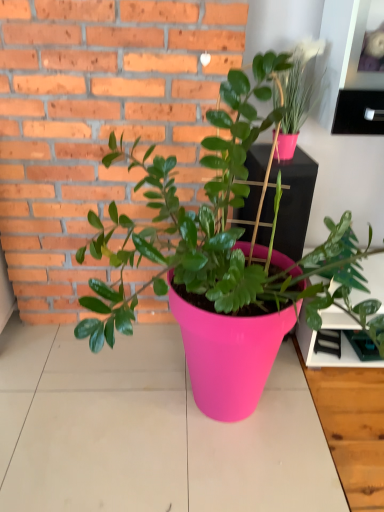
This screenshot has height=512, width=384. What do you see at coordinates (224, 260) in the screenshot? I see `pink plastic pot at center, the 1th houseplant viewed from the left` at bounding box center [224, 260].

Find the location of `pink plastic table top at center`. pink plastic table top at center is located at coordinates (149, 431).

What do you see at coordinates (294, 96) in the screenshot?
I see `matte pink pot at upper right, which is counted as the first houseplant, starting from the right` at bounding box center [294, 96].

You are a GUI agent. You are given a task and a screenshot of the screen. Output one action in this format:
    pyautogui.click(x=<x>, y=<y>)
    Task: Click on the pink plastic pot at center, the 1th houseplant viewed from the left
    
    Given the screenshot: What is the action you would take?
    pyautogui.click(x=224, y=260)

Could you measure the distance between pink plastic shelf at upper right and pink plastic pot at center, the 1th houseplant viewed from the left?

pink plastic shelf at upper right and pink plastic pot at center, the 1th houseplant viewed from the left, are 27.58 inches apart.

Is the position of pink plastic shelf at upper right less distant than that of pink plastic pot at center, the 1th houseplant viewed from the left?

No, pink plastic shelf at upper right is further to the viewer.

Which point is more distant from viewer, (339,110) or (228,400)?

The point (339,110) is farther from the camera.

Are pink plastic shelf at upper right and pink plastic pot at center, acting as the 2th houseplant starting from the right, far apart?

No, pink plastic shelf at upper right is in close proximity to pink plastic pot at center, acting as the 2th houseplant starting from the right.

Considering the sizes of objects matte pink pot at upper right, which is counted as the first houseplant, starting from the right, and pink plastic shelf at upper right in the image provided, who is bigger, matte pink pot at upper right, which is counted as the first houseplant, starting from the right, or pink plastic shelf at upper right?

matte pink pot at upper right, which is counted as the first houseplant, starting from the right, is bigger.

Does matte pink pot at upper right, which is counted as the first houseplant, starting from the right, appear on the right side of pink plastic shelf at upper right?

No, matte pink pot at upper right, which is counted as the first houseplant, starting from the right, is not to the right of pink plastic shelf at upper right.

Is matte pink pot at upper right, which is counted as the first houseplant, starting from the right, spatially inside pink plastic shelf at upper right, or outside of it?

matte pink pot at upper right, which is counted as the first houseplant, starting from the right, is outside pink plastic shelf at upper right.

Choose the correct answer: Is matte pink pot at upper right, positioned as the 2th houseplant in left-to-right order, inside pink plastic table top at center or outside it?

matte pink pot at upper right, positioned as the 2th houseplant in left-to-right order, is not inside pink plastic table top at center, it's outside.

Between matte pink pot at upper right, which is counted as the first houseplant, starting from the right, and pink plastic table top at center, which one has smaller width?

Thinner between the two is matte pink pot at upper right, which is counted as the first houseplant, starting from the right.

Considering the relative sizes of matte pink pot at upper right, positioned as the 2th houseplant in left-to-right order, and pink plastic table top at center in the image provided, is matte pink pot at upper right, positioned as the 2th houseplant in left-to-right order, shorter than pink plastic table top at center?

Incorrect, the height of matte pink pot at upper right, positioned as the 2th houseplant in left-to-right order, does not fall short of that of pink plastic table top at center.

Does point (292, 103) lie behind point (91, 380)?

No, (292, 103) is in front of (91, 380).

Considering the relative positions of pink plastic table top at center and matte pink pot at upper right, which is counted as the first houseplant, starting from the right, in the image provided, is pink plastic table top at center behind matte pink pot at upper right, which is counted as the first houseplant, starting from the right,?

→ No, pink plastic table top at center is in front of matte pink pot at upper right, which is counted as the first houseplant, starting from the right.

From the image's perspective, is pink plastic table top at center above or below matte pink pot at upper right, which is counted as the first houseplant, starting from the right?

From the image's perspective, pink plastic table top at center appears below matte pink pot at upper right, which is counted as the first houseplant, starting from the right.

From a real-world perspective, between pink plastic table top at center and matte pink pot at upper right, positioned as the 2th houseplant in left-to-right order, who is vertically lower?

In real-world perspective, pink plastic table top at center is lower.

Is pink plastic table top at center bigger than matte pink pot at upper right, which is counted as the first houseplant, starting from the right?

Correct, pink plastic table top at center is larger in size than matte pink pot at upper right, which is counted as the first houseplant, starting from the right.

Is pink plastic shelf at upper right not inside pink plastic table top at center?

Yes, pink plastic shelf at upper right is located beyond the bounds of pink plastic table top at center.

In the scene shown: Between pink plastic shelf at upper right and pink plastic table top at center, which one has more height?

pink plastic shelf at upper right is taller.

From the image's perspective, is pink plastic shelf at upper right located above or below pink plastic table top at center?

pink plastic shelf at upper right is situated higher than pink plastic table top at center in the image.

In the scene shown: Is pink plastic shelf at upper right positioned far away from pink plastic table top at center?

Yes, pink plastic shelf at upper right is far from pink plastic table top at center.

Can you confirm if pink plastic pot at center, the 1th houseplant viewed from the left, is positioned to the left of pink plastic table top at center?

In fact, pink plastic pot at center, the 1th houseplant viewed from the left, is to the right of pink plastic table top at center.

Is the position of pink plastic pot at center, the 1th houseplant viewed from the left, less distant than that of pink plastic table top at center?

Yes.

Image resolution: width=384 pixels, height=512 pixels. What are the coordinates of `table top that is under the pink plastic pot at center, acting as the 2th houseplant starting from the right (from a real-world perspective)` in the screenshot? It's located at (149, 431).

Based on the photo, is pink plastic table top at center far from pink plastic shelf at upper right?

Absolutely, pink plastic table top at center is distant from pink plastic shelf at upper right.

Considering the sizes of objects pink plastic table top at center and pink plastic shelf at upper right in the image provided, who is thinner, pink plastic table top at center or pink plastic shelf at upper right?

pink plastic shelf at upper right is thinner.

Where is `shelf behind the pink plastic pot at center, the 1th houseplant viewed from the left`? This screenshot has width=384, height=512. shelf behind the pink plastic pot at center, the 1th houseplant viewed from the left is located at coordinates (359, 112).

The height and width of the screenshot is (512, 384). In order to click on shelf below the matte pink pot at upper right, which is counted as the first houseplant, starting from the right (from a real-world perspective) in this screenshot , I will do `click(359, 112)`.

From the image, which object appears to be farther from pink plastic pot at center, acting as the 2th houseplant starting from the right, pink plastic shelf at upper right or pink plastic table top at center?

Based on the image, pink plastic shelf at upper right appears to be further to pink plastic pot at center, acting as the 2th houseplant starting from the right.

Which object lies nearer to the anchor point pink plastic table top at center, matte pink pot at upper right, positioned as the 2th houseplant in left-to-right order, or pink plastic shelf at upper right?

The object closer to pink plastic table top at center is matte pink pot at upper right, positioned as the 2th houseplant in left-to-right order.

Considering their positions, is pink plastic table top at center positioned closer to matte pink pot at upper right, which is counted as the first houseplant, starting from the right, than pink plastic pot at center, the 1th houseplant viewed from the left?

pink plastic pot at center, the 1th houseplant viewed from the left, is closer to matte pink pot at upper right, which is counted as the first houseplant, starting from the right.

From the image, which object appears to be farther from pink plastic pot at center, acting as the 2th houseplant starting from the right, pink plastic table top at center or matte pink pot at upper right, which is counted as the first houseplant, starting from the right?

Among the two, matte pink pot at upper right, which is counted as the first houseplant, starting from the right, is located further to pink plastic pot at center, acting as the 2th houseplant starting from the right.

When comparing their distances from matte pink pot at upper right, positioned as the 2th houseplant in left-to-right order, does pink plastic pot at center, the 1th houseplant viewed from the left, or pink plastic shelf at upper right seem closer?

Based on the image, pink plastic shelf at upper right appears to be nearer to matte pink pot at upper right, positioned as the 2th houseplant in left-to-right order.

Estimate the real-world distances between objects in this image. Which object is further from pink plastic table top at center, pink plastic pot at center, acting as the 2th houseplant starting from the right, or matte pink pot at upper right, positioned as the 2th houseplant in left-to-right order?

Based on the image, matte pink pot at upper right, positioned as the 2th houseplant in left-to-right order, appears to be further to pink plastic table top at center.

When comparing their distances from matte pink pot at upper right, which is counted as the first houseplant, starting from the right, does pink plastic pot at center, the 1th houseplant viewed from the left, or pink plastic table top at center seem closer?

pink plastic pot at center, the 1th houseplant viewed from the left, lies closer to matte pink pot at upper right, which is counted as the first houseplant, starting from the right, than the other object.

Based on their spatial positions, is pink plastic shelf at upper right or matte pink pot at upper right, positioned as the 2th houseplant in left-to-right order, closer to pink plastic pot at center, acting as the 2th houseplant starting from the right?

The object closer to pink plastic pot at center, acting as the 2th houseplant starting from the right, is matte pink pot at upper right, positioned as the 2th houseplant in left-to-right order.

You are a GUI agent. You are given a task and a screenshot of the screen. Output one action in this format:
    pyautogui.click(x=<x>, y=<y>)
    Task: Click on the shelf between matte pink pot at upper right, positioned as the 2th houseplant in left-to-right order, and pink plastic table top at center from top to bottom
    This screenshot has width=384, height=512.
    Given the screenshot: What is the action you would take?
    pyautogui.click(x=359, y=112)

Where is `houseplant between pink plastic shelf at upper right and pink plastic table top at center vertically`? houseplant between pink plastic shelf at upper right and pink plastic table top at center vertically is located at coordinates (224, 260).

Locate an element on the screen. houseplant located between pink plastic pot at center, acting as the 2th houseplant starting from the right, and pink plastic shelf at upper right in the depth direction is located at coordinates (294, 96).

At what (x,y) coordinates should I click in order to perform the action: click on houseplant between matte pink pot at upper right, which is counted as the first houseplant, starting from the right, and pink plastic table top at center from top to bottom. Please return your answer as a coordinate pair (x, y). The width and height of the screenshot is (384, 512). Looking at the image, I should click on coord(224,260).